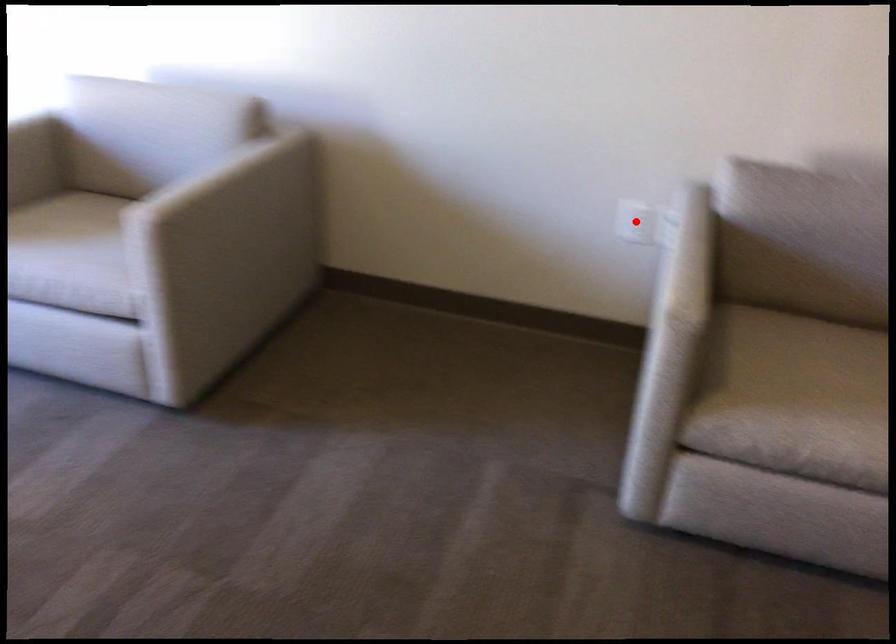
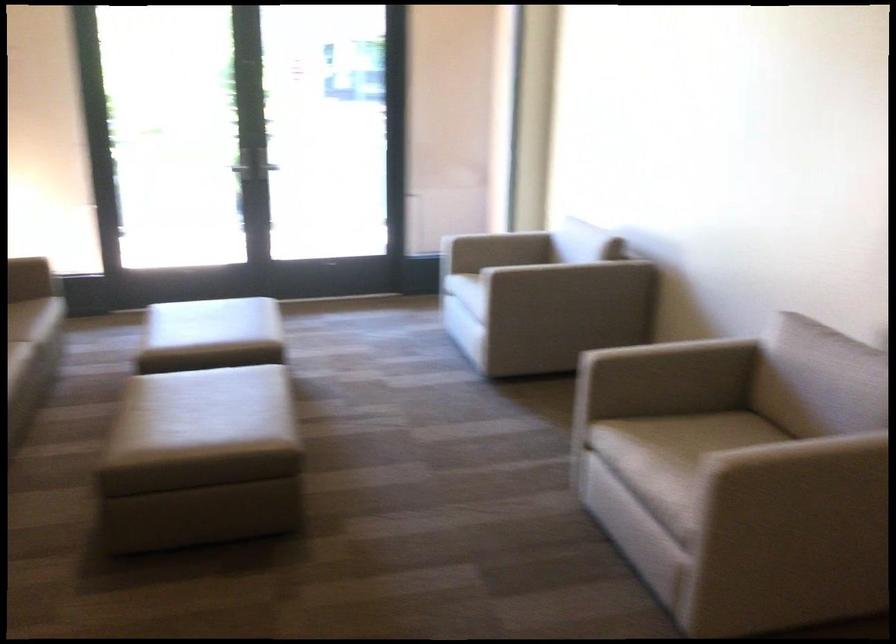
Question: I am providing you with two images of the same scene from different viewpoints. A red point is marked on the first image. Can you still see the location of the red point in image 2?

Choices:
 (A) Yes
 (B) No

Answer: (B)